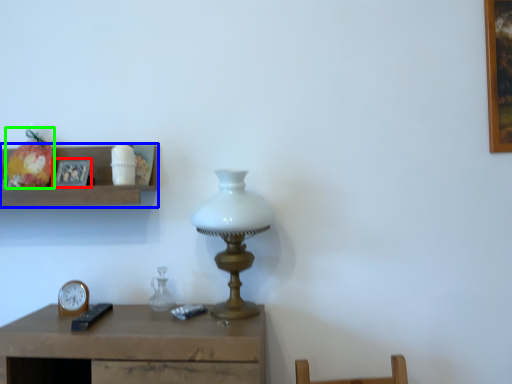
Question: Which is nearer to the picture frame (highlighted by a red box)? shelf (highlighted by a blue box) or fruit (highlighted by a green box).

Choices:
 (A) shelf
 (B) fruit

Answer: (A)